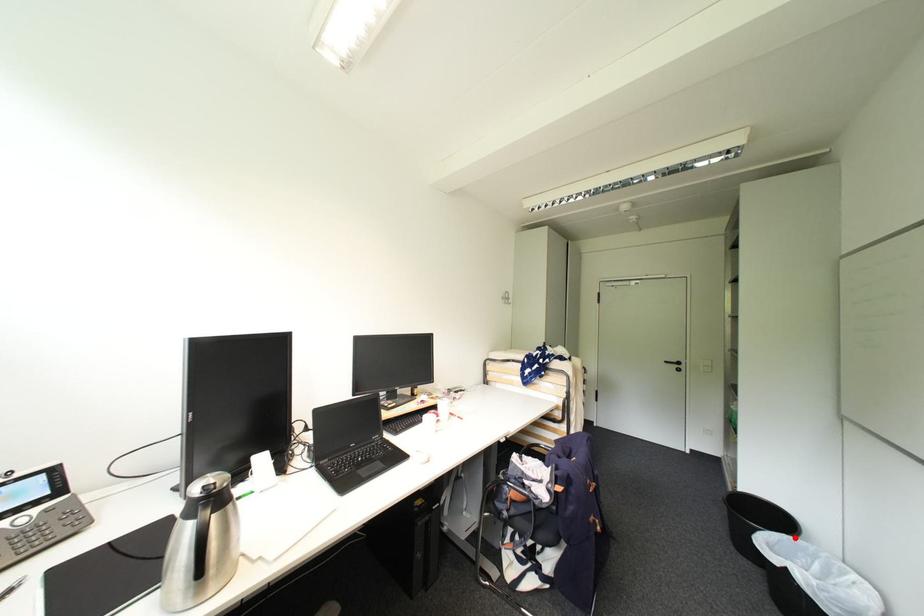
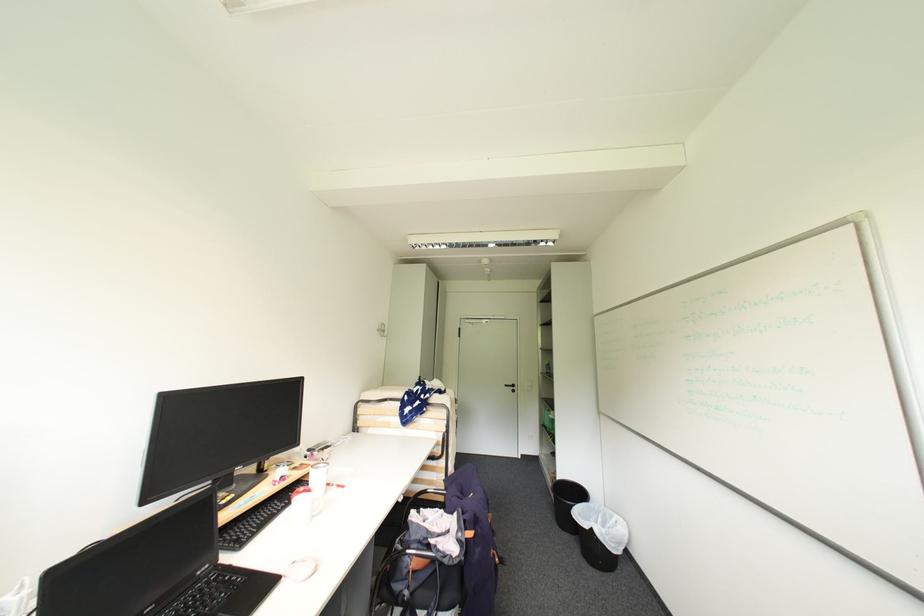
Find the pixel in the second image that matches the highlighted location in the first image.

(591, 505)